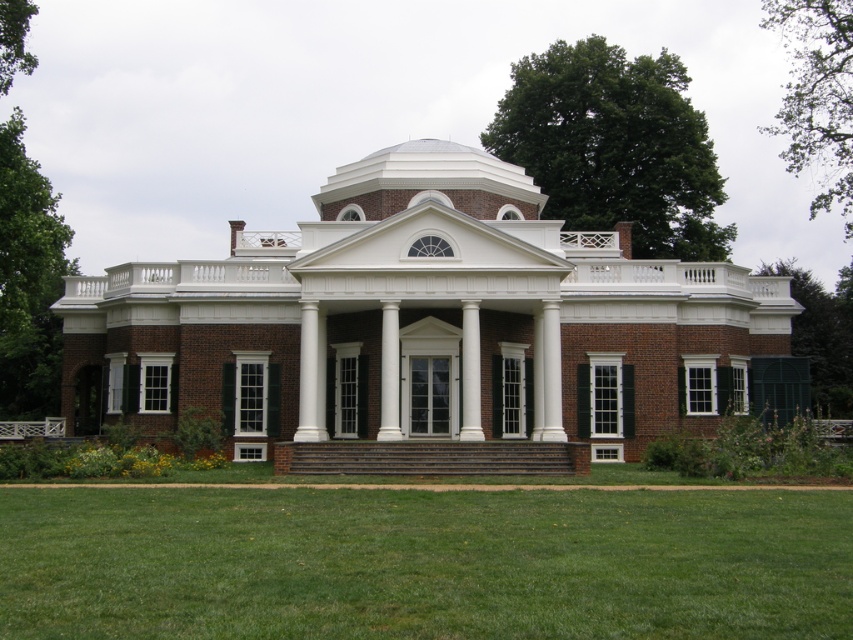
You are standing in front of the brick mansion at center. If you were to walk directly towards the mansion, which direction should you face?

Since the brick mansion at center is positioned at point coordinates of (x=428, y=323), you should face north to walk directly towards it.

Looking at this image, you are standing in front of the brick mansion at center and want to walk towards the green grass at lower center. Which direction should you face to move towards it?

To move towards the green grass at lower center, you should face downward since the green grass at lower center is located below the brick mansion at center.